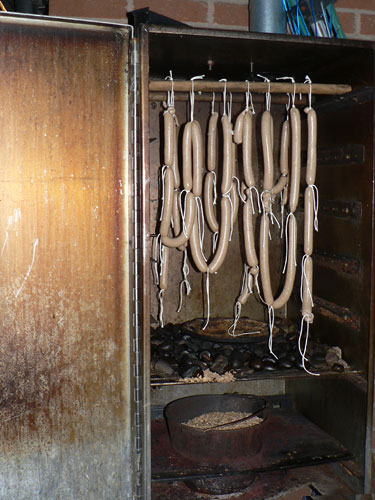
Identify the location of bottom shelf. The width and height of the screenshot is (375, 500). (338, 476).